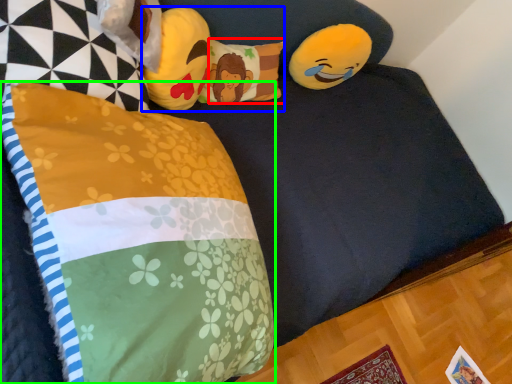
Question: Based on their relative distances, which object is nearer to pillow (highlighted by a red box)? Choose from toy (highlighted by a blue box) and pillow (highlighted by a green box).

Choices:
 (A) toy
 (B) pillow

Answer: (A)